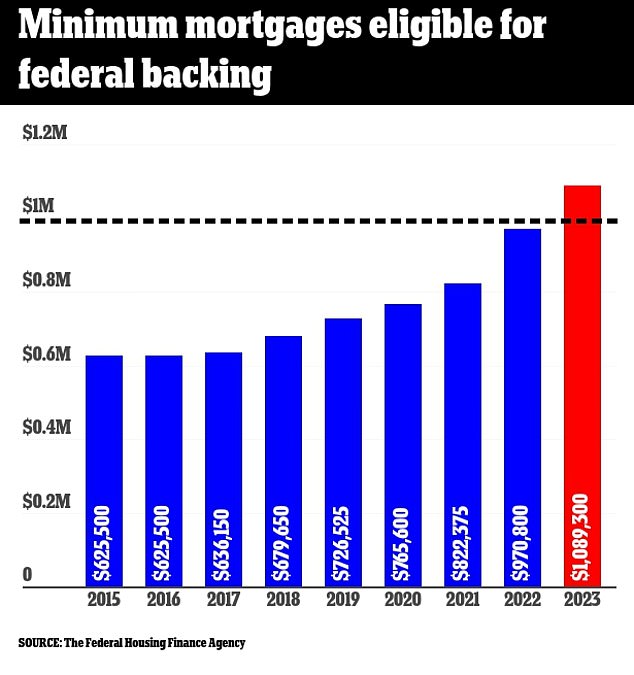
The height and width of the screenshot is (675, 634). What are the coordinates of `red column` in the screenshot? It's located at pos(591,374).